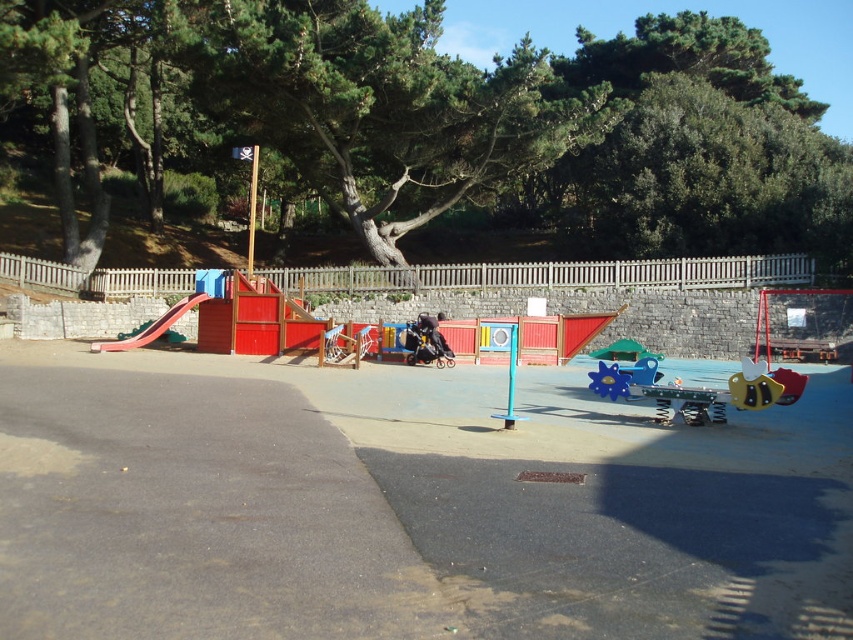
You are a parent trying to locate your child who is playing near the red plastic slide at left and the blue plastic spinner at center. Which equipment is closer to you?

The red plastic slide at left is closer to you because it is further to the viewer than the blue plastic spinner at center.

Consider the image. You are a parent trying to decide which playground equipment to let your child play on first. You see the red plastic slide at left and the blue plastic spinner at center. Which one is bigger?

The red plastic slide at left is larger in size than the blue plastic spinner at center, so the red plastic slide at left is bigger.